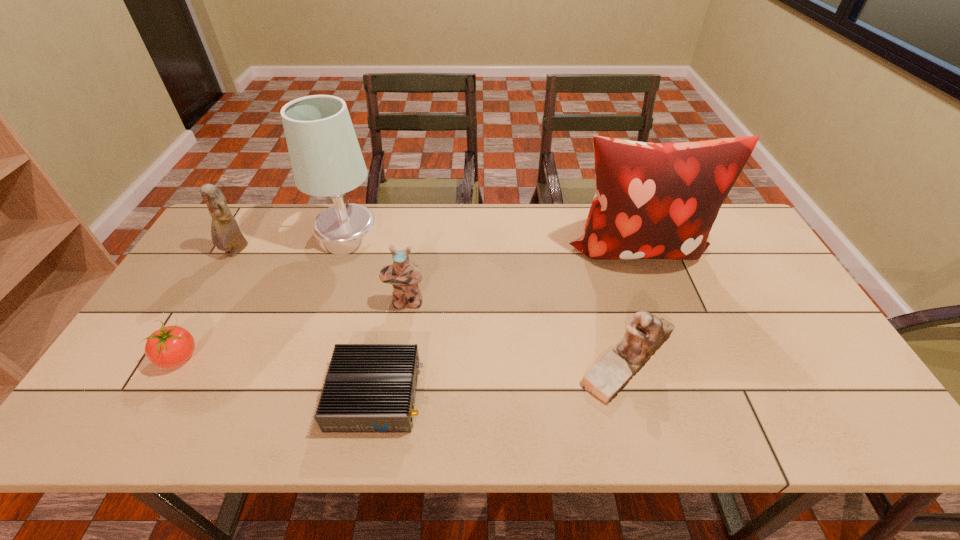
The image size is (960, 540). What are the coordinates of `free point located on the base of the lampshade` in the screenshot? It's located at (465, 234).

In order to click on free spot located on the front-facing side of the cushion in this screenshot , I will do `click(665, 319)`.

In order to click on vacant area situated 0.090m on the front-facing side of the leftmost figurine in this screenshot , I will do `click(218, 282)`.

The image size is (960, 540). I want to click on vacant space located 0.150m on the front-facing side of the second figurine from left to right, so click(396, 357).

Locate an element on the screen. The height and width of the screenshot is (540, 960). blank space located on the front-facing side of the shortest figurine is located at coordinates (430, 360).

Locate an element on the screen. blank space located on the front-facing side of the shortest figurine is located at coordinates (511, 360).

You are a GUI agent. You are given a task and a screenshot of the screen. Output one action in this format:
    pyautogui.click(x=<x>, y=<y>)
    Task: Click on the free spot located 0.290m on the front-facing side of the shortest figurine
    
    Given the screenshot: What is the action you would take?
    pyautogui.click(x=458, y=360)

Where is `free space located 0.050m on the right of the tomato`? free space located 0.050m on the right of the tomato is located at coordinates (220, 357).

Where is `vacant space located 0.290m on the back panel of the shortest object`? The width and height of the screenshot is (960, 540). vacant space located 0.290m on the back panel of the shortest object is located at coordinates (547, 395).

In order to click on lampshade that is at the far edge in this screenshot , I will do click(326, 159).